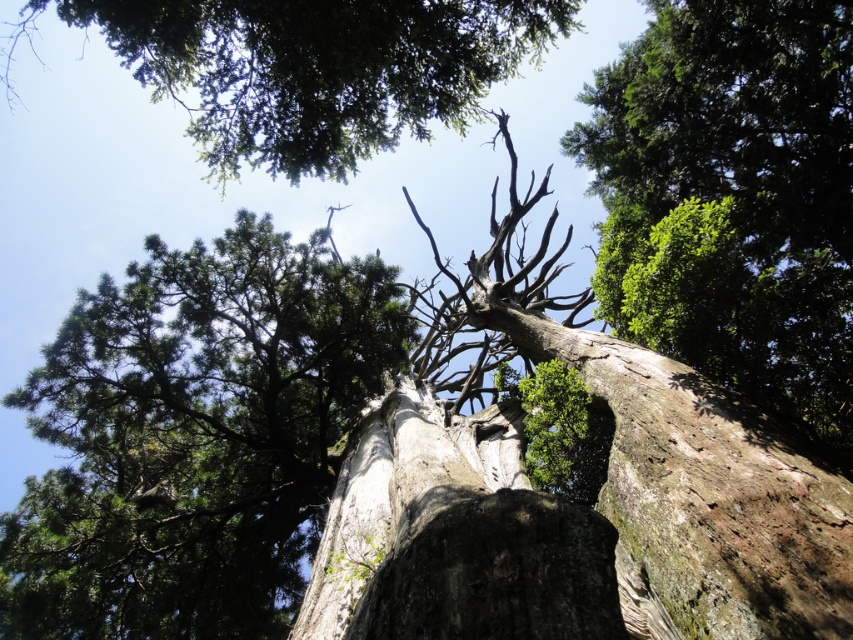
Is point (392, 88) farther from camera compared to point (466, 600)?

Yes, point (392, 88) is farther from viewer.

Does green rough bark tree at upper center have a lesser width compared to dark gray rough rock at center?

Incorrect, green rough bark tree at upper center's width is not less than dark gray rough rock at center's.

Locate an element on the screen. green rough bark tree at upper center is located at coordinates (315, 68).

Who is more forward, (155, 576) or (601, 301)?

Point (601, 301) is more forward.

Does green rough bark tree at center come behind green rough bark tree at upper right?

Yes, green rough bark tree at center is behind green rough bark tree at upper right.

Who is more forward, (294, 525) or (726, 40)?

Point (726, 40) is in front.

At what (x,y) coordinates should I click in order to perform the action: click on green rough bark tree at center. Please return your answer as a coordinate pair (x, y). This screenshot has height=640, width=853. Looking at the image, I should click on (195, 436).

Is green rough bark tree at upper right above dark gray rough rock at center?

Correct, green rough bark tree at upper right is located above dark gray rough rock at center.

Does green rough bark tree at upper right appear on the left side of dark gray rough rock at center?

In fact, green rough bark tree at upper right is to the right of dark gray rough rock at center.

Which is behind, point (799, 216) or point (563, 636)?

The point (799, 216) is behind.

In order to click on green rough bark tree at upper right in this screenshot , I will do `click(733, 198)`.